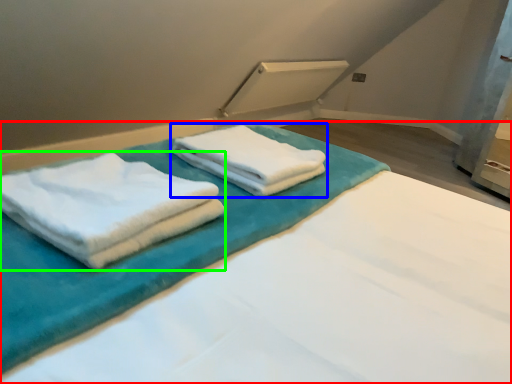
Question: Estimate the real-world distances between objects in this image. Which object is farther from bed (highlighted by a red box), towel (highlighted by a blue box) or towel (highlighted by a green box)?

Choices:
 (A) towel
 (B) towel

Answer: (B)